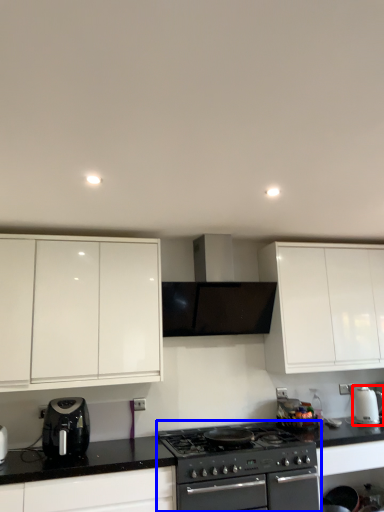
Question: Among these objects, which one is farthest to the camera, kitchen appliance (highlighted by a red box) or appliance (highlighted by a blue box)?

Choices:
 (A) kitchen appliance
 (B) appliance

Answer: (A)